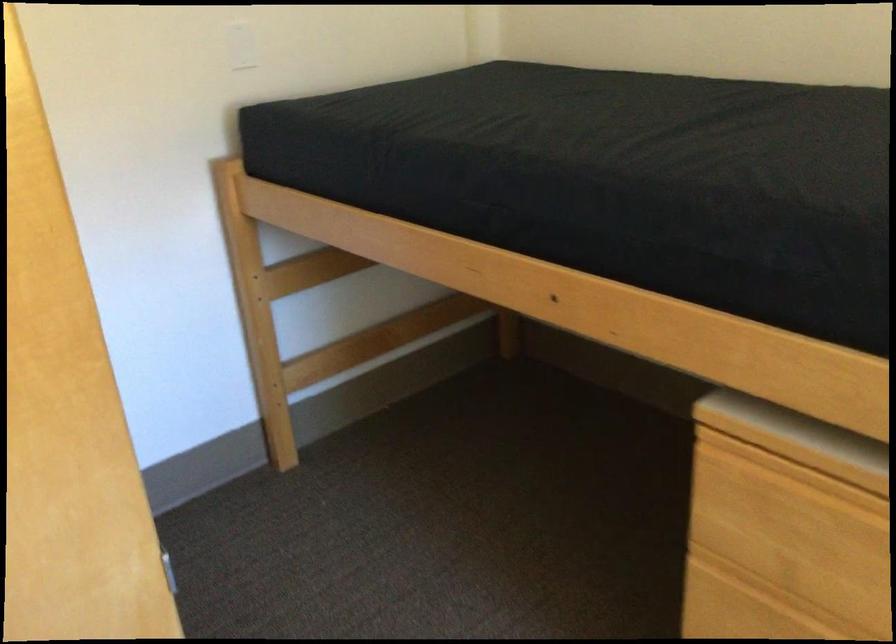
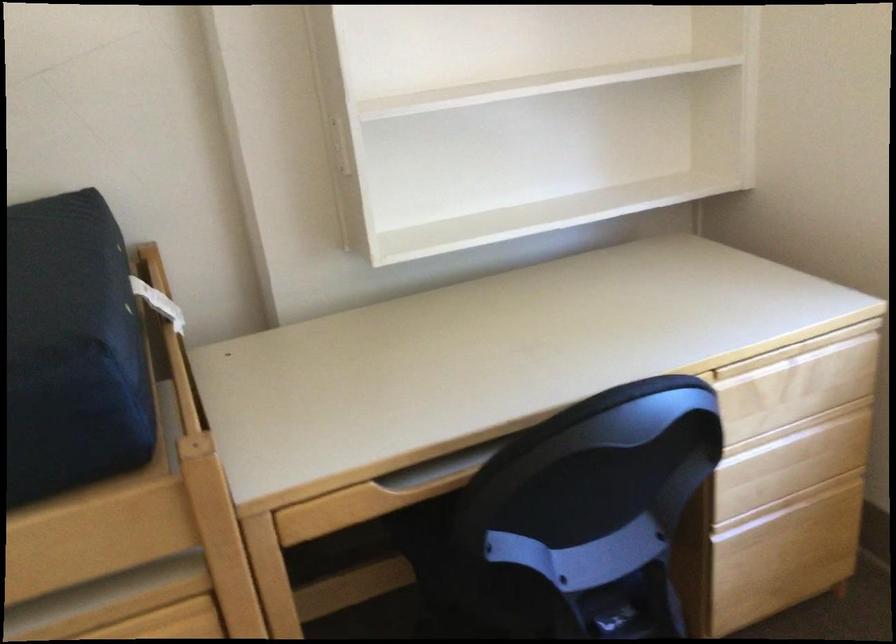
Question: The images are taken continuously from a first-person perspective. In which direction is your viewpoint rotating?

Choices:
 (A) Left
 (B) Right
 (C) Up
 (D) Down

Answer: (B)